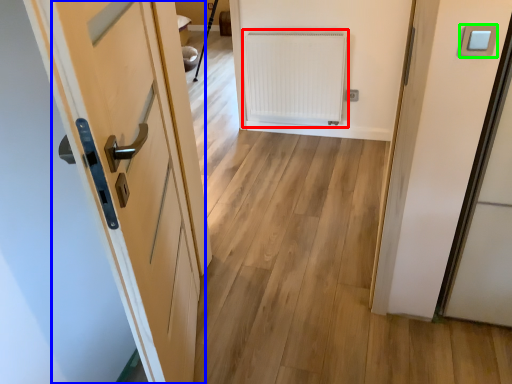
Question: Estimate the real-world distances between objects in this image. Which object is farther from radiator (highlighted by a red box), door (highlighted by a blue box) or light switch (highlighted by a green box)?

Choices:
 (A) door
 (B) light switch

Answer: (B)